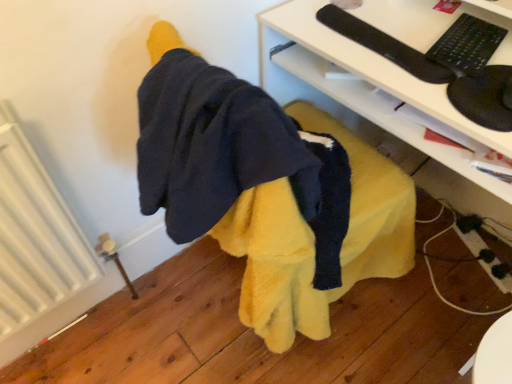
Question: Is black matte keyboard at upper right taller than white glossy desk at center?

Choices:
 (A) yes
 (B) no

Answer: (B)

Question: From a real-world perspective, is black matte keyboard at upper right under white glossy desk at center?

Choices:
 (A) no
 (B) yes

Answer: (A)

Question: Is black matte keyboard at upper right turned away from white glossy desk at center?

Choices:
 (A) yes
 (B) no

Answer: (B)

Question: Considering the relative sizes of black matte keyboard at upper right and white glossy desk at center in the image provided, is black matte keyboard at upper right thinner than white glossy desk at center?

Choices:
 (A) no
 (B) yes

Answer: (B)

Question: From a real-world perspective, is black matte keyboard at upper right over white glossy desk at center?

Choices:
 (A) yes
 (B) no

Answer: (A)

Question: From a real-world perspective, is black matte keyboard at upper right positioned above or below white ribbed radiator at left?

Choices:
 (A) below
 (B) above

Answer: (B)

Question: Visually, is black matte keyboard at upper right positioned to the left or to the right of white ribbed radiator at left?

Choices:
 (A) right
 (B) left

Answer: (A)

Question: Looking at their shapes, would you say black matte keyboard at upper right is wider or thinner than white ribbed radiator at left?

Choices:
 (A) thin
 (B) wide

Answer: (B)

Question: Considering their positions, is black matte keyboard at upper right located in front of or behind white ribbed radiator at left?

Choices:
 (A) front
 (B) behind

Answer: (B)

Question: Considering the positions of point (382, 18) and point (67, 248), is point (382, 18) closer or farther from the camera than point (67, 248)?

Choices:
 (A) farther
 (B) closer

Answer: (A)

Question: Considering the positions of white glossy desk at center and white ribbed radiator at left in the image, is white glossy desk at center bigger or smaller than white ribbed radiator at left?

Choices:
 (A) small
 (B) big

Answer: (B)

Question: From the image's perspective, is white glossy desk at center above or below white ribbed radiator at left?

Choices:
 (A) below
 (B) above

Answer: (B)

Question: Looking at their shapes, would you say white glossy desk at center is wider or thinner than white ribbed radiator at left?

Choices:
 (A) thin
 (B) wide

Answer: (B)

Question: Considering the positions of white ribbed radiator at left and white glossy desk at center in the image, is white ribbed radiator at left taller or shorter than white glossy desk at center?

Choices:
 (A) short
 (B) tall

Answer: (A)

Question: Based on their sizes in the image, would you say white ribbed radiator at left is bigger or smaller than white glossy desk at center?

Choices:
 (A) big
 (B) small

Answer: (B)